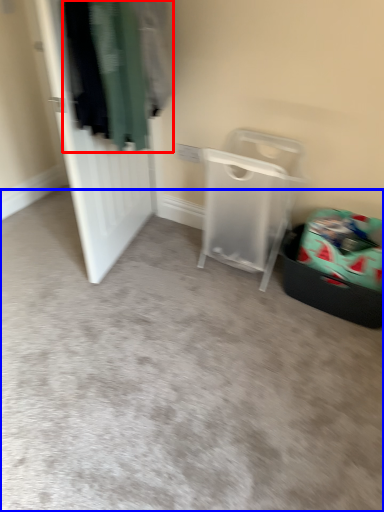
Question: Which object is closer to the camera taking this photo, clothing (highlighted by a red box) or plain (highlighted by a blue box)?

Choices:
 (A) clothing
 (B) plain

Answer: (B)